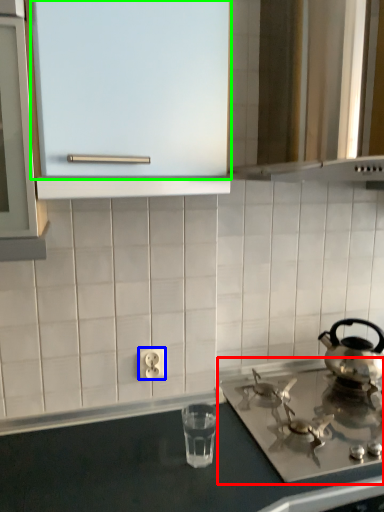
Question: Estimate the real-world distances between objects in this image. Which object is farther from gas stove (highlighted by a red box), electric outlet (highlighted by a blue box) or glass door (highlighted by a green box)?

Choices:
 (A) electric outlet
 (B) glass door

Answer: (B)